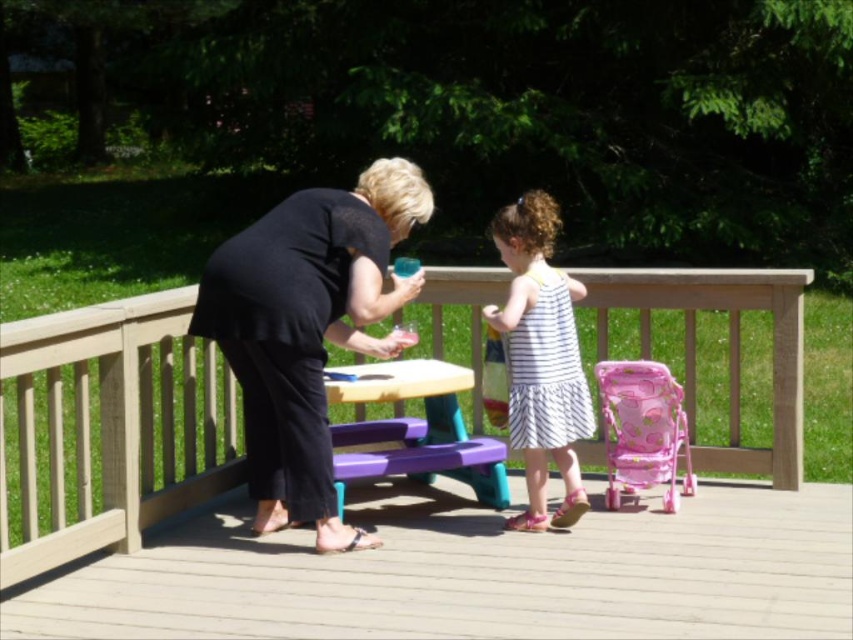
Question: Is black matte dress at center thinner than pink fabric baby carriage at right?

Choices:
 (A) yes
 (B) no

Answer: (B)

Question: Which point is farther to the camera?

Choices:
 (A) (184, 488)
 (B) (463, 435)

Answer: (B)

Question: Is black matte dress at center to the left of pink fabric baby carriage at right from the viewer's perspective?

Choices:
 (A) yes
 (B) no

Answer: (A)

Question: Can you confirm if wooden picnic table at center is positioned below wooden deck at center?

Choices:
 (A) no
 (B) yes

Answer: (A)

Question: Which object is positioned farthest from the pink fabric baby carriage at right?

Choices:
 (A) black matte dress at center
 (B) purple plastic picnic table at center
 (C) wooden deck at center

Answer: (A)

Question: Which point is closer to the camera taking this photo?

Choices:
 (A) (387, 468)
 (B) (633, 592)
 (C) (318, 269)
 (D) (749, 288)

Answer: (B)